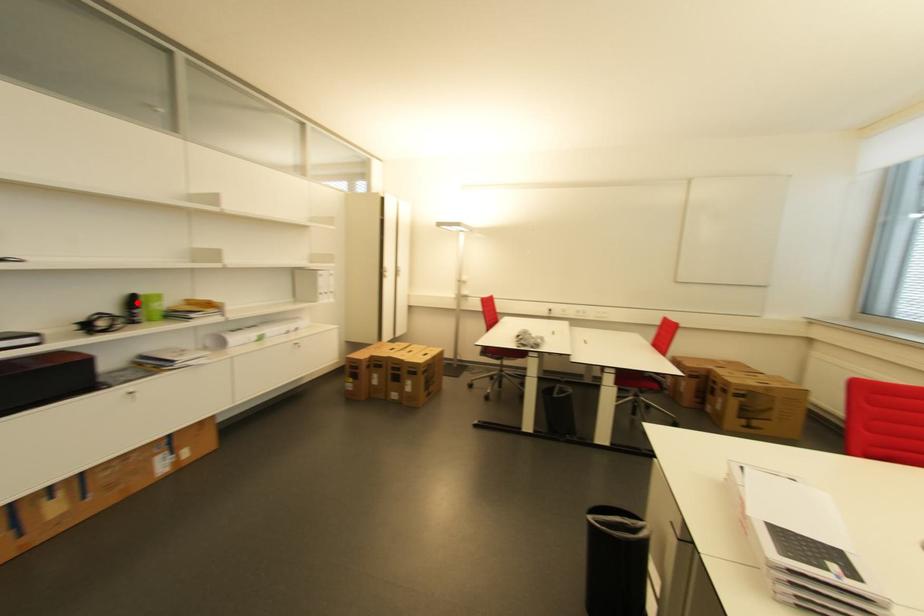
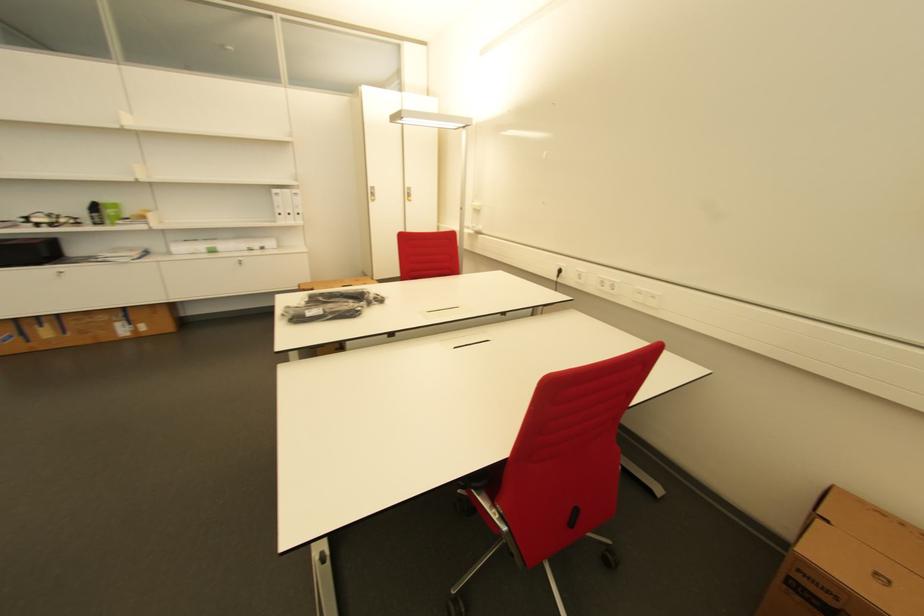
Question: I am providing you with two images of the same scene from different viewpoints. A red point is marked on the first image. Is the red point's position out of view in image 2?

Choices:
 (A) Yes
 (B) No

Answer: (B)